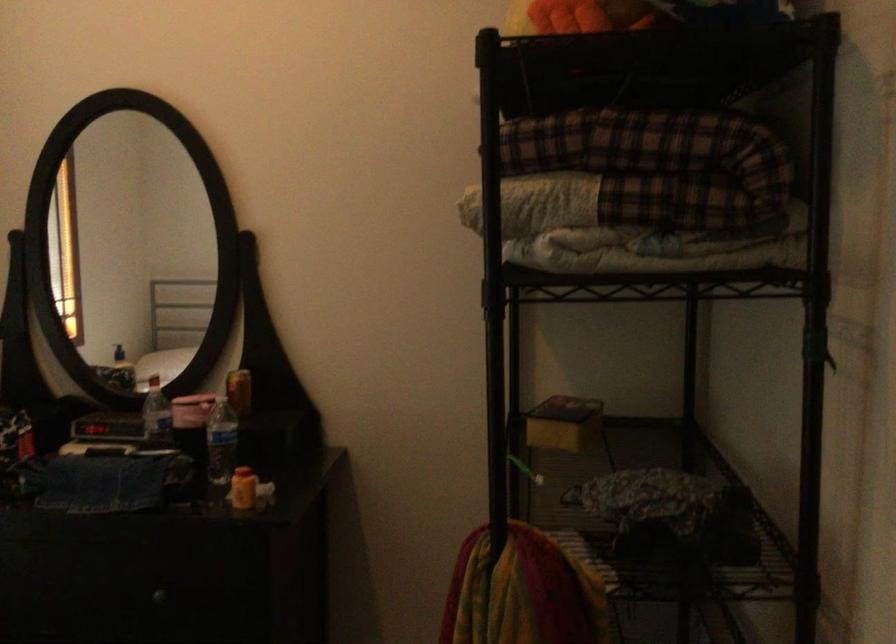
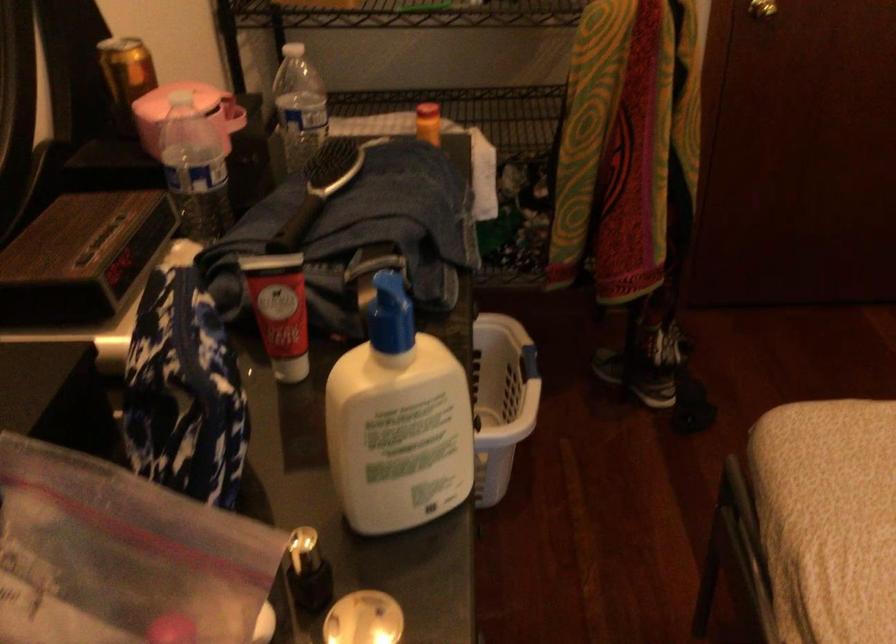
The point at (217, 426) is marked in the first image. Where is the corresponding point in the second image?

(298, 106)